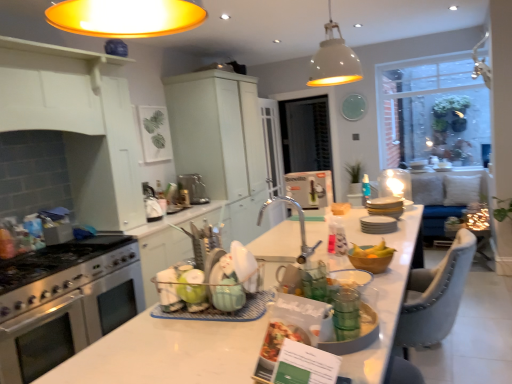
Question: Considering the positions of point pyautogui.click(x=377, y=268) and point pyautogui.click(x=252, y=145), is point pyautogui.click(x=377, y=268) closer or farther from the camera than point pyautogui.click(x=252, y=145)?

Choices:
 (A) farther
 (B) closer

Answer: (B)

Question: Considering their positions, is wooden bowl at center located in front of or behind matte white cabinet at upper center, which is counted as the 1th cabinetry, starting from the right?

Choices:
 (A) behind
 (B) front

Answer: (B)

Question: Based on their relative distances, which object is nearer to the clear glass window screen at center, which appears as the first window screen when viewed from the left?

Choices:
 (A) green glass cups at center, which is counted as the second tableware, starting from the top
 (B) matte green glass at center
 (C) blue plastic spray bottle at center
 (D) white glossy plates at center, marked as the second tableware in a bottom-to-top arrangement
 (E) white glossy plates at center, which appears as the 1th appliance when viewed from the right

Answer: (C)

Question: Estimate the real-world distances between objects in this image. Which object is farther from the metallic silver faucet at upper center?

Choices:
 (A) white glossy plates at center, placed as the 1th tableware when sorted from top to bottom
 (B) clear glass window screen at center, which appears as the 2th window screen when viewed from the right
 (C) white matte pendant lamp at upper center
 (D) stainless steel gas stove at left
 (E) blue plastic spray bottle at center

Answer: (D)